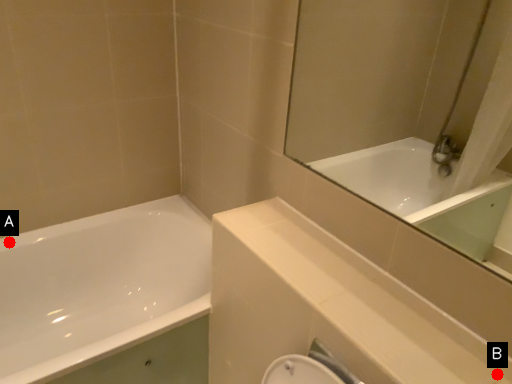
Question: Two points are circled on the image, labeled by A and B beside each circle. Which of the following is the closest to the observer?

Choices:
 (A) A is closer
 (B) B is closer

Answer: (B)